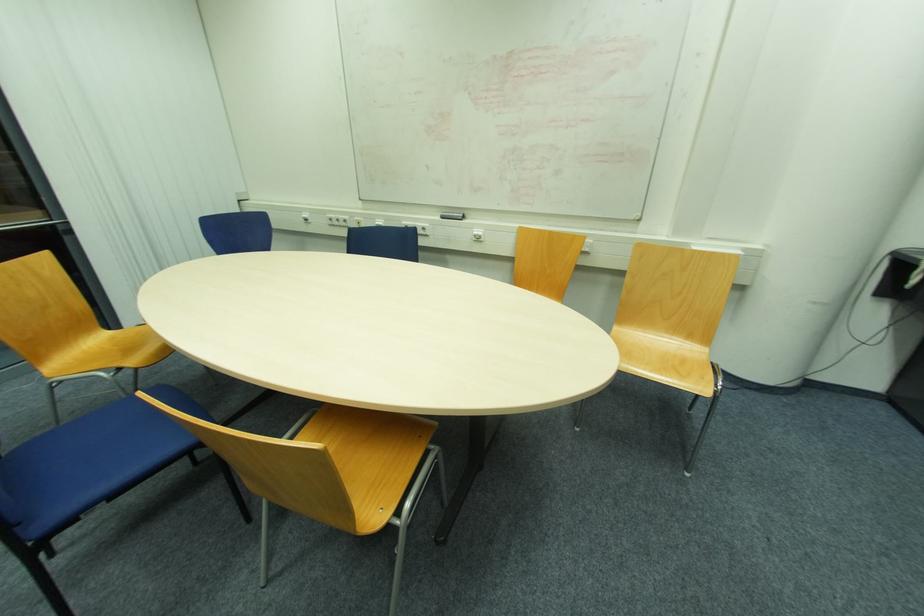
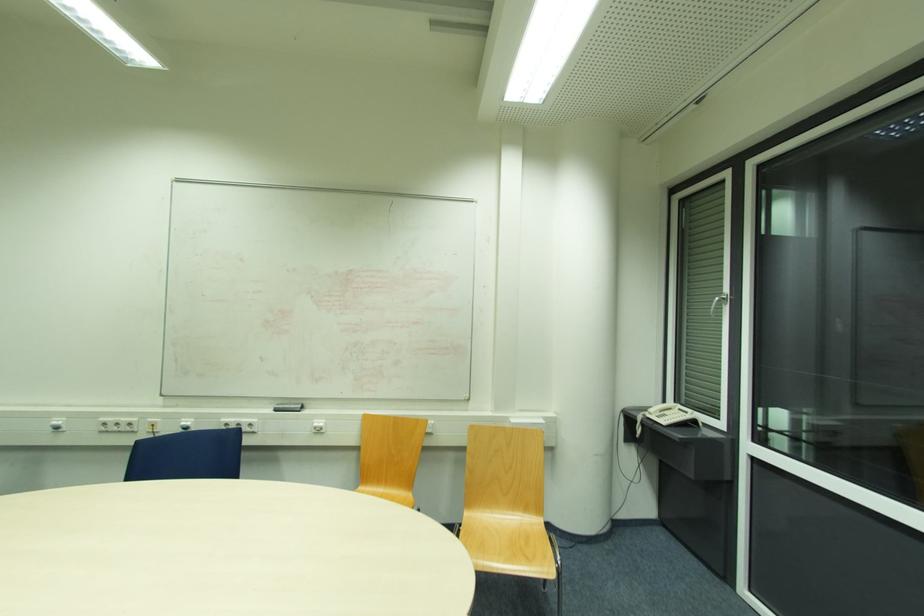
Find the pixel in the second image that matches (704,379) in the first image.

(546, 557)